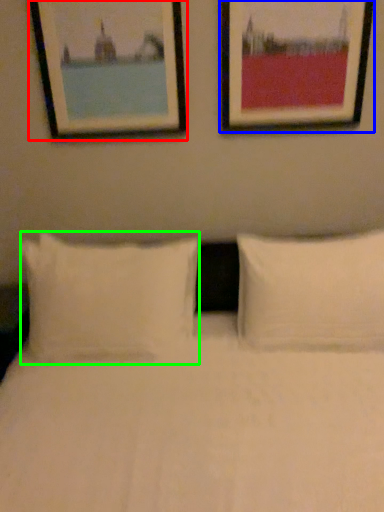
Question: Which object is positioned closest to picture frame (highlighted by a red box)? Select from picture frame (highlighted by a blue box) and pillow (highlighted by a green box).

Choices:
 (A) picture frame
 (B) pillow

Answer: (A)